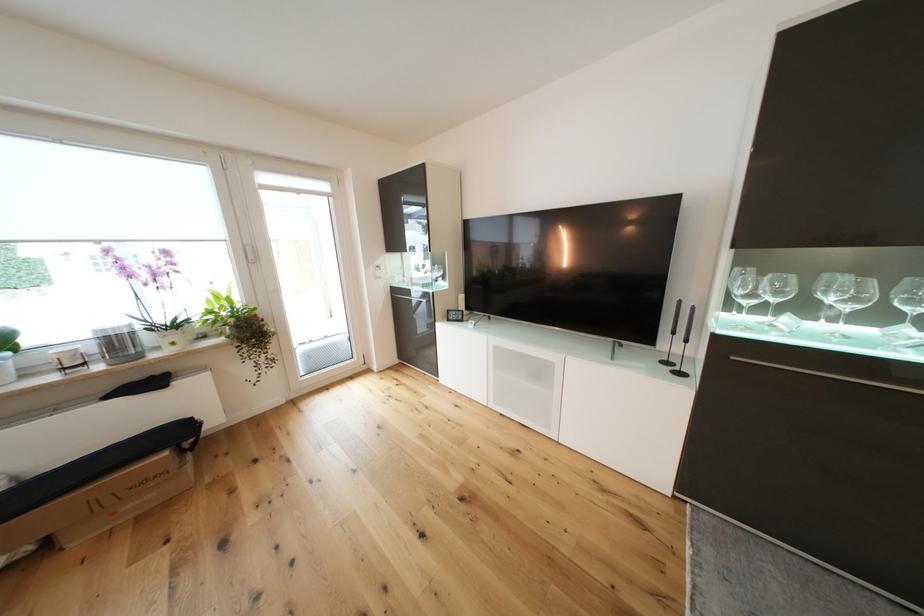
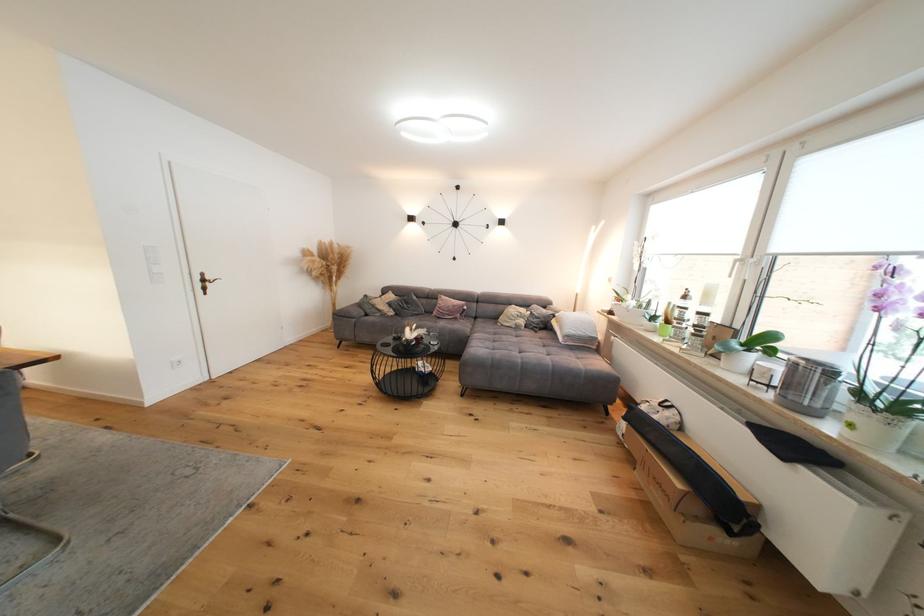
Locate, in the second image, the point that corresponds to (174,387) in the first image.

(793, 461)